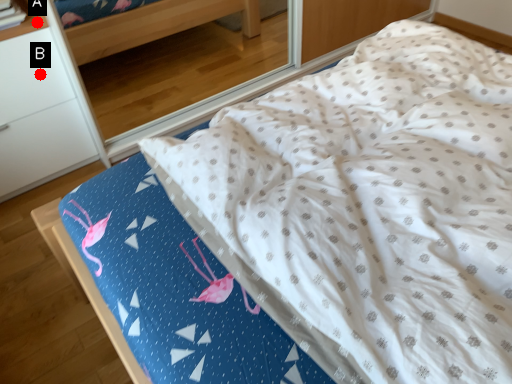
Question: Two points are circled on the image, labeled by A and B beside each circle. Which point appears farthest from the camera in this image?

Choices:
 (A) A is further
 (B) B is further

Answer: (B)